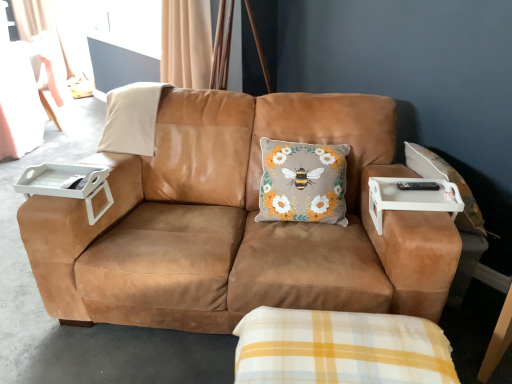
Describe the element at coordinates (67, 184) in the screenshot. This screenshot has width=512, height=384. I see `white plastic tray at left, placed as the second table when sorted from right to left` at that location.

Where is `white plastic tray at right, the second table viewed from the left`? Image resolution: width=512 pixels, height=384 pixels. white plastic tray at right, the second table viewed from the left is located at coordinates (412, 196).

Where is `beige suede pillow at upper left`? beige suede pillow at upper left is located at coordinates (132, 119).

The height and width of the screenshot is (384, 512). What do you see at coordinates (237, 223) in the screenshot?
I see `suede brown couch at center` at bounding box center [237, 223].

Identify the location of white plastic tray at left, the first table viewed from the left. (67, 184).

From the image's perspective, is suede brown couch at center located beneath white plastic tray at right, the 1th table from the right?

No.

Which object is positioned more to the left, suede brown couch at center or white plastic tray at right, the second table viewed from the left?

suede brown couch at center.

Choose the correct answer: Is suede brown couch at center inside white plastic tray at right, the second table viewed from the left, or outside it?

suede brown couch at center is not inside white plastic tray at right, the second table viewed from the left, it's outside.

Is point (297, 112) more distant than point (446, 200)?

Yes.

Is suede brown couch at center located outside floral-patterned fabric cushion at center?

That's correct, suede brown couch at center is outside of floral-patterned fabric cushion at center.

Is suede brown couch at center to the right of floral-patterned fabric cushion at center from the viewer's perspective?

No, suede brown couch at center is not to the right of floral-patterned fabric cushion at center.

Considering the relative sizes of suede brown couch at center and floral-patterned fabric cushion at center in the image provided, is suede brown couch at center bigger than floral-patterned fabric cushion at center?

Correct, suede brown couch at center is larger in size than floral-patterned fabric cushion at center.

This screenshot has height=384, width=512. Find the location of `the 2nd table below when counting from the beige suede pillow at upper left (from the image's perspective)`. the 2nd table below when counting from the beige suede pillow at upper left (from the image's perspective) is located at coordinates (412, 196).

Is point (118, 119) less distant than point (383, 203)?

No, it is behind (383, 203).

Is beige suede pillow at upper left oriented towards white plastic tray at right, the 1th table from the right?

No, beige suede pillow at upper left is not facing towards white plastic tray at right, the 1th table from the right.

Can you confirm if beige suede pillow at upper left is smaller than white plastic tray at left, placed as the second table when sorted from right to left?

Actually, beige suede pillow at upper left might be larger than white plastic tray at left, placed as the second table when sorted from right to left.

Considering the sizes of objects beige suede pillow at upper left and white plastic tray at left, the first table viewed from the left, in the image provided, who is shorter, beige suede pillow at upper left or white plastic tray at left, the first table viewed from the left,?

white plastic tray at left, the first table viewed from the left, is shorter.

Is beige suede pillow at upper left aimed at white plastic tray at left, the first table viewed from the left?

Yes, beige suede pillow at upper left is oriented towards white plastic tray at left, the first table viewed from the left.

Looking at this image, which is correct: beige suede pillow at upper left is inside white plastic tray at left, the first table viewed from the left, or outside of it?

beige suede pillow at upper left cannot be found inside white plastic tray at left, the first table viewed from the left.

Who is bigger, white plastic tray at left, the first table viewed from the left, or suede brown couch at center?

suede brown couch at center is bigger.

In the scene shown: Who is shorter, white plastic tray at left, the first table viewed from the left, or suede brown couch at center?

white plastic tray at left, the first table viewed from the left, is shorter.

Is white plastic tray at left, placed as the second table when sorted from right to left, closer to camera compared to suede brown couch at center?

No, the depth of white plastic tray at left, placed as the second table when sorted from right to left, is greater than that of suede brown couch at center.

Is white plastic tray at left, the first table viewed from the left, facing away from suede brown couch at center?

Absolutely, white plastic tray at left, the first table viewed from the left, is directed away from suede brown couch at center.

From the image's perspective, which object appears higher, suede brown couch at center or beige suede pillow at upper left?

From the image's view, beige suede pillow at upper left is above.

Could beige suede pillow at upper left be considered to be inside suede brown couch at center?

Yes, suede brown couch at center is surrounding beige suede pillow at upper left.

Is suede brown couch at center smaller than beige suede pillow at upper left?

No, suede brown couch at center is not smaller than beige suede pillow at upper left.

From a real-world perspective, which object rests below the other?

white plastic tray at right, the 1th table from the right, is physically lower.

How far apart are white plastic tray at right, the 1th table from the right, and beige suede pillow at upper left?

white plastic tray at right, the 1th table from the right, and beige suede pillow at upper left are 1.22 meters apart.

Where is `the 2nd table below when counting from the beige suede pillow at upper left (from the image's perspective)`? the 2nd table below when counting from the beige suede pillow at upper left (from the image's perspective) is located at coordinates (412, 196).

Where is `studio couch below the white plastic tray at right, the 1th table from the right (from a real-world perspective)`? studio couch below the white plastic tray at right, the 1th table from the right (from a real-world perspective) is located at coordinates (237, 223).

Find the location of a particular element. studio couch that appears in front of the floral-patterned fabric cushion at center is located at coordinates (237, 223).

Based on their spatial positions, is floral-patterned fabric cushion at center or beige suede pillow at upper left further from white plastic tray at left, placed as the second table when sorted from right to left?

Based on the image, floral-patterned fabric cushion at center appears to be further to white plastic tray at left, placed as the second table when sorted from right to left.

Based on their spatial positions, is suede brown couch at center or beige suede pillow at upper left further from white plastic tray at right, the 1th table from the right?

Based on the image, beige suede pillow at upper left appears to be further to white plastic tray at right, the 1th table from the right.

When comparing their distances from white plastic tray at right, the second table viewed from the left, does suede brown couch at center or white plastic tray at left, placed as the second table when sorted from right to left, seem closer?

suede brown couch at center lies closer to white plastic tray at right, the second table viewed from the left, than the other object.

From the picture: Estimate the real-world distances between objects in this image. Which object is further from white plastic tray at left, the first table viewed from the left, beige suede pillow at upper left or floral-patterned fabric cushion at center?

floral-patterned fabric cushion at center.

Considering their positions, is white plastic tray at right, the second table viewed from the left, positioned closer to beige suede pillow at upper left than suede brown couch at center?

The object closer to beige suede pillow at upper left is suede brown couch at center.

Which object lies nearer to the anchor point floral-patterned fabric cushion at center, beige suede pillow at upper left or white plastic tray at left, placed as the second table when sorted from right to left?

beige suede pillow at upper left lies closer to floral-patterned fabric cushion at center than the other object.

Which object lies nearer to the anchor point beige suede pillow at upper left, white plastic tray at right, the 1th table from the right, or white plastic tray at left, placed as the second table when sorted from right to left?

white plastic tray at left, placed as the second table when sorted from right to left, is closer to beige suede pillow at upper left.

Looking at the image, which one is located further to beige suede pillow at upper left, white plastic tray at left, placed as the second table when sorted from right to left, or white plastic tray at right, the 1th table from the right?

white plastic tray at right, the 1th table from the right.

Locate an element on the screen. studio couch situated between white plastic tray at left, the first table viewed from the left, and white plastic tray at right, the second table viewed from the left, from left to right is located at coordinates (237, 223).

This screenshot has height=384, width=512. I want to click on pillow between white plastic tray at left, the first table viewed from the left, and floral-patterned fabric cushion at center from left to right, so click(132, 119).

Where is `studio couch located between beige suede pillow at upper left and floral-patterned fabric cushion at center in the left-right direction`? studio couch located between beige suede pillow at upper left and floral-patterned fabric cushion at center in the left-right direction is located at coordinates (237, 223).

You are a GUI agent. You are given a task and a screenshot of the screen. Output one action in this format:
    pyautogui.click(x=<x>, y=<y>)
    Task: Click on the throw pillow between beige suede pillow at upper left and white plastic tray at right, the 1th table from the right, from left to right
    
    Given the screenshot: What is the action you would take?
    pyautogui.click(x=303, y=182)